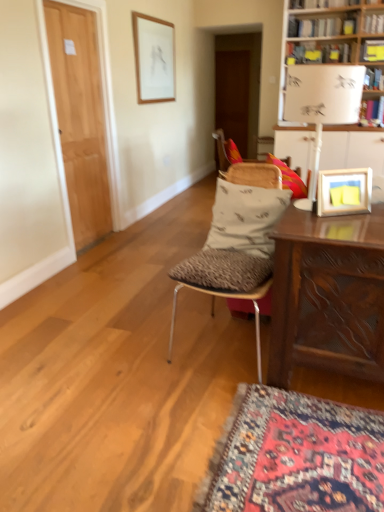
Question: Does wooden picture frame at upper right, which is the 1th picture frame from right to left, have a smaller size compared to hardcover book at upper center, which is the second book in top-to-bottom order?

Choices:
 (A) no
 (B) yes

Answer: (B)

Question: From a real-world perspective, does wooden picture frame at upper right, which is counted as the second picture frame, starting from the left, sit lower than hardcover book at upper center, which ranks as the 2th book in bottom-to-top order?

Choices:
 (A) yes
 (B) no

Answer: (A)

Question: Considering the relative positions of wooden picture frame at upper right, which is the 1th picture frame from right to left, and hardcover book at upper center, which is the second book in top-to-bottom order, in the image provided, is wooden picture frame at upper right, which is the 1th picture frame from right to left, to the left of hardcover book at upper center, which is the second book in top-to-bottom order, from the viewer's perspective?

Choices:
 (A) yes
 (B) no

Answer: (A)

Question: Considering the relative sizes of wooden picture frame at upper right, which appears as the first picture frame when ordered from the bottom, and hardcover book at upper center, which is the second book in top-to-bottom order, in the image provided, is wooden picture frame at upper right, which appears as the first picture frame when ordered from the bottom, thinner than hardcover book at upper center, which is the second book in top-to-bottom order,?

Choices:
 (A) yes
 (B) no

Answer: (A)

Question: Is wooden picture frame at upper right, arranged as the 2th picture frame when viewed from the back, in front of hardcover book at upper center, which ranks as the 2th book in bottom-to-top order?

Choices:
 (A) no
 (B) yes

Answer: (B)

Question: Choose the correct answer: Is white wooden table at upper right inside metallic silver chair at center, which ranks as the second chair in back-to-front order, or outside it?

Choices:
 (A) outside
 (B) inside

Answer: (A)

Question: Based on their positions, is white wooden table at upper right located to the left or right of metallic silver chair at center, which ranks as the second chair in back-to-front order?

Choices:
 (A) right
 (B) left

Answer: (A)

Question: Is white wooden table at upper right in front of or behind metallic silver chair at center, which ranks as the second chair in back-to-front order, in the image?

Choices:
 (A) behind
 (B) front

Answer: (A)

Question: Considering the positions of point (365, 153) and point (241, 272), is point (365, 153) closer or farther from the camera than point (241, 272)?

Choices:
 (A) farther
 (B) closer

Answer: (B)

Question: From the image's perspective, is light brown wood door at left, the 1th door viewed from the front, above or below brown wooden door at center, marked as the first door in a right-to-left arrangement?

Choices:
 (A) above
 (B) below

Answer: (B)

Question: In terms of height, does light brown wood door at left, the second door positioned from the top, look taller or shorter compared to brown wooden door at center, marked as the first door in a right-to-left arrangement?

Choices:
 (A) short
 (B) tall

Answer: (B)

Question: Based on their sizes in the image, would you say light brown wood door at left, the second door positioned from the top, is bigger or smaller than brown wooden door at center, arranged as the second door when ordered from the bottom?

Choices:
 (A) small
 (B) big

Answer: (B)

Question: Based on their positions, is light brown wood door at left, marked as the 2th door in a right-to-left arrangement, located to the left or right of brown wooden door at center, placed as the 1th door when sorted from top to bottom?

Choices:
 (A) right
 (B) left

Answer: (B)

Question: Based on their sizes in the image, would you say yellow paper at upper right, which ranks as the 1th book in bottom-to-top order, is bigger or smaller than patterned fabric pillow at center?

Choices:
 (A) big
 (B) small

Answer: (B)

Question: Considering the positions of point (367, 53) and point (266, 225), is point (367, 53) closer or farther from the camera than point (266, 225)?

Choices:
 (A) farther
 (B) closer

Answer: (B)